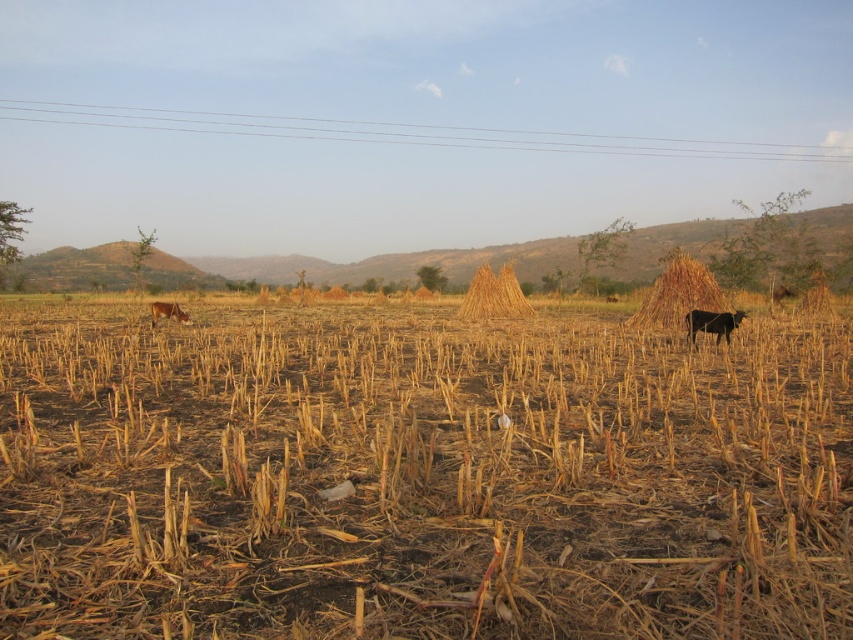
Is brown straw stack at right taller than brown fur dog at lower left?

Yes.

In the scene shown: Can you confirm if brown straw stack at right is positioned above brown fur dog at lower left?

Yes.

Who is more distant from viewer, (717,292) or (186,316)?

Positioned behind is point (717,292).

You are a GUI agent. You are given a task and a screenshot of the screen. Output one action in this format:
    pyautogui.click(x=<x>, y=<y>)
    Task: Click on the brown straw stack at right
    This screenshot has height=640, width=853.
    Given the screenshot: What is the action you would take?
    pyautogui.click(x=679, y=294)

Is point (244, 497) positioned behind point (170, 307)?

No, (244, 497) is closer to viewer.

Is brown dry grass at center taller than brown fur dog at lower left?

Correct, brown dry grass at center is much taller as brown fur dog at lower left.

Between point (546, 342) and point (167, 316), which one is positioned behind?

The point (167, 316) is behind.

At what (x,y) coordinates should I click in order to perform the action: click on brown dry grass at center. Please return your answer as a coordinate pair (x, y). Looking at the image, I should click on (419, 476).

Is brown straw stack at right thinner than black glossy cow at right?

In fact, brown straw stack at right might be wider than black glossy cow at right.

This screenshot has width=853, height=640. What do you see at coordinates (679, 294) in the screenshot?
I see `brown straw stack at right` at bounding box center [679, 294].

Identify the location of brown straw stack at right. (679, 294).